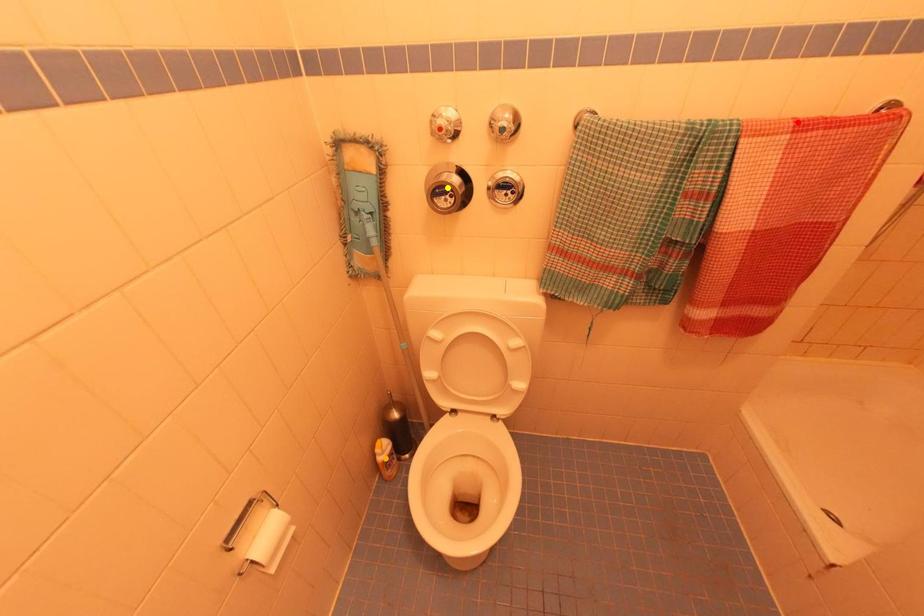
Order these from nearest to farthest:
- yellow point
- red point
- orange point

red point, yellow point, orange point